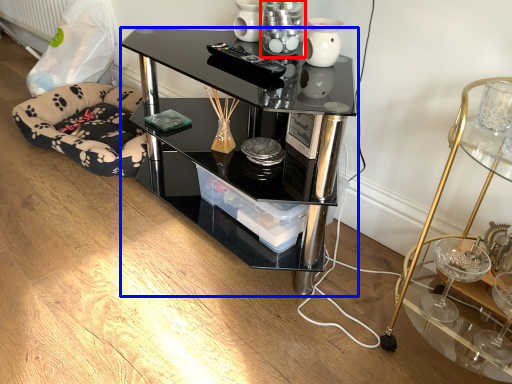
Question: Which object appears farthest to the camera in this image, candle holder (highlighted by a red box) or desk (highlighted by a blue box)?

Choices:
 (A) candle holder
 (B) desk

Answer: (A)